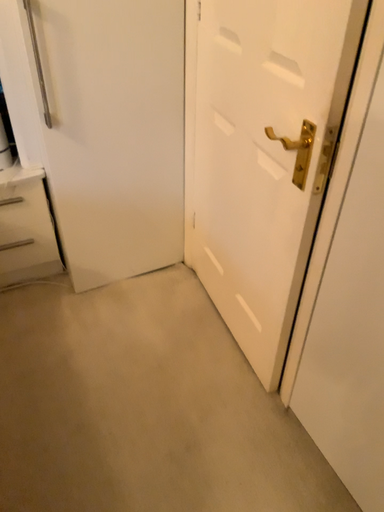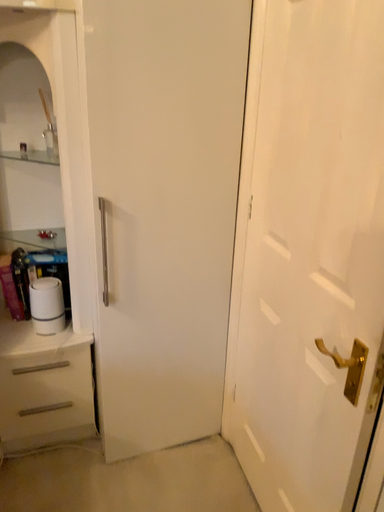
Question: How did the camera likely rotate when shooting the video?

Choices:
 (A) rotated downward
 (B) rotated upward

Answer: (B)